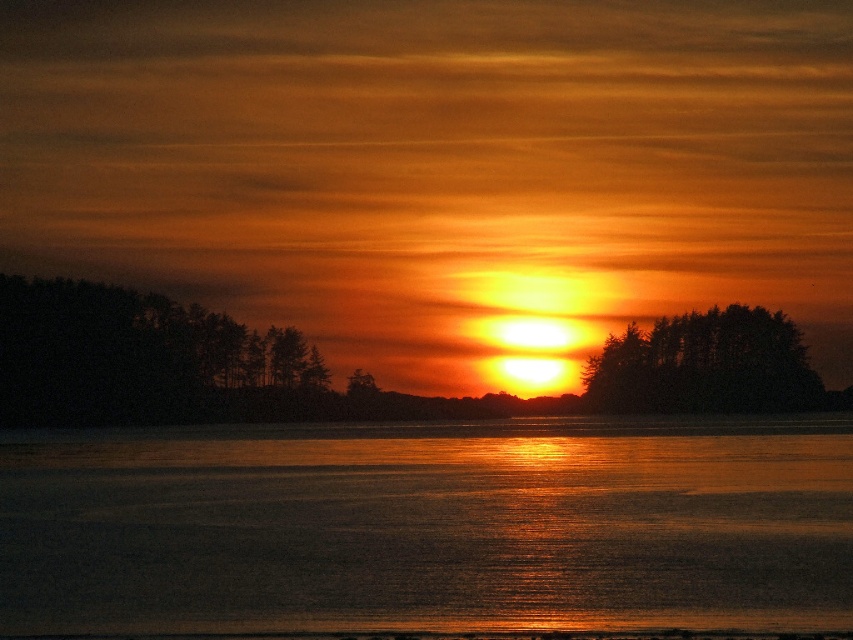
What do you see at coordinates (430, 525) in the screenshot?
I see `glistening water at center` at bounding box center [430, 525].

Can you confirm if glistening water at center is positioned below dark green textured trees at center?

Indeed, glistening water at center is positioned under dark green textured trees at center.

Between point (757, 499) and point (751, 314), which one is positioned in front?

Point (757, 499) is in front.

At what (x,y) coordinates should I click in order to perform the action: click on glistening water at center. Please return your answer as a coordinate pair (x, y). The height and width of the screenshot is (640, 853). Looking at the image, I should click on (430, 525).

Which of these two, dark green textured trees at left or dark green textured trees at center, stands shorter?

dark green textured trees at center

Find the location of `dark green textured trees at left`. dark green textured trees at left is located at coordinates (146, 360).

This screenshot has width=853, height=640. In order to click on dark green textured trees at left in this screenshot , I will do `click(146, 360)`.

Is glistening water at center above dark green textured trees at left?

Incorrect, glistening water at center is not positioned above dark green textured trees at left.

Is the position of glistening water at center more distant than that of dark green textured trees at left?

No, it is not.

Who is more forward, (248, 497) or (256, 372)?

Point (248, 497) is more forward.

You are a GUI agent. You are given a task and a screenshot of the screen. Output one action in this format:
    pyautogui.click(x=<x>, y=<y>)
    Task: Click on the glistening water at center
    
    Given the screenshot: What is the action you would take?
    pyautogui.click(x=430, y=525)